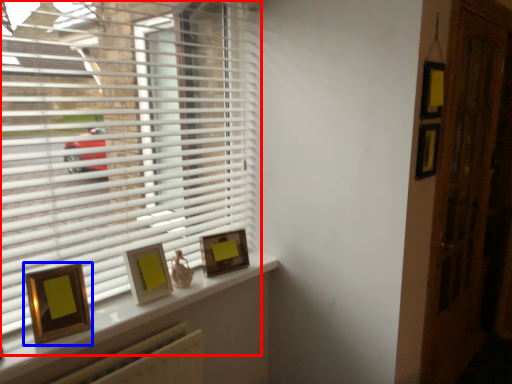
Question: Which object appears closest to the camera in this image, window blind (highlighted by a red box) or picture frame (highlighted by a blue box)?

Choices:
 (A) window blind
 (B) picture frame

Answer: (A)